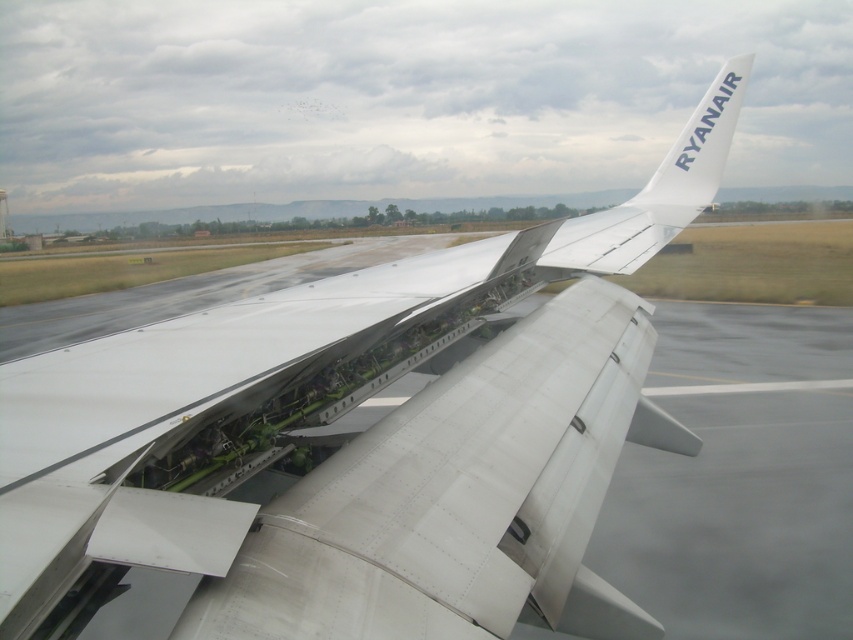
Question: Does white metallic wing at center have a larger size compared to white matte airplane tail at upper right?

Choices:
 (A) yes
 (B) no

Answer: (B)

Question: Where is white metallic wing at center located in relation to white matte airplane tail at upper right in the image?

Choices:
 (A) below
 (B) above

Answer: (A)

Question: Which of the following is the farthest from the observer?

Choices:
 (A) (677, 177)
 (B) (625, 416)

Answer: (A)

Question: Is white metallic wing at center positioned behind white matte airplane tail at upper right?

Choices:
 (A) yes
 (B) no

Answer: (B)

Question: Which of the following is the farthest from the observer?

Choices:
 (A) white matte airplane tail at upper right
 (B) white metallic wing at center

Answer: (A)